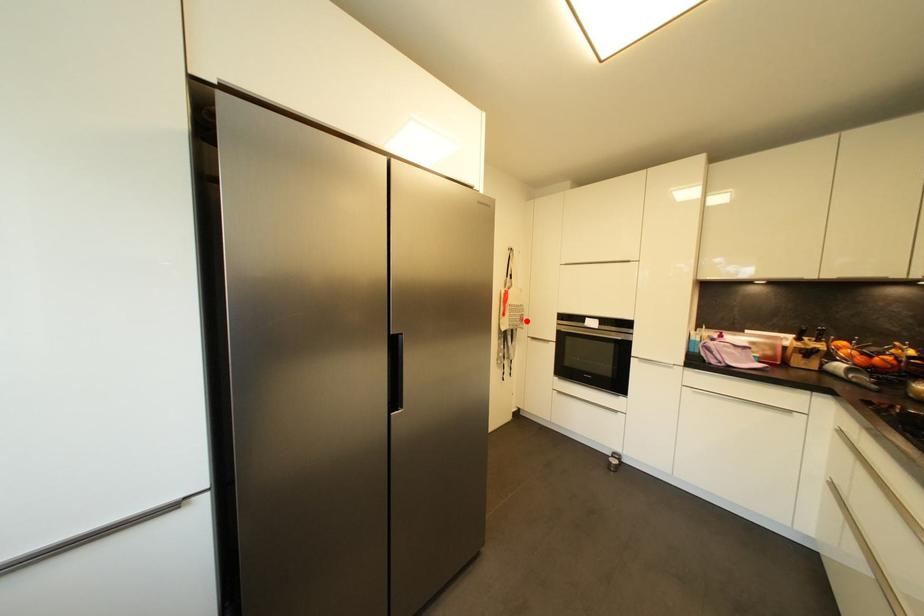
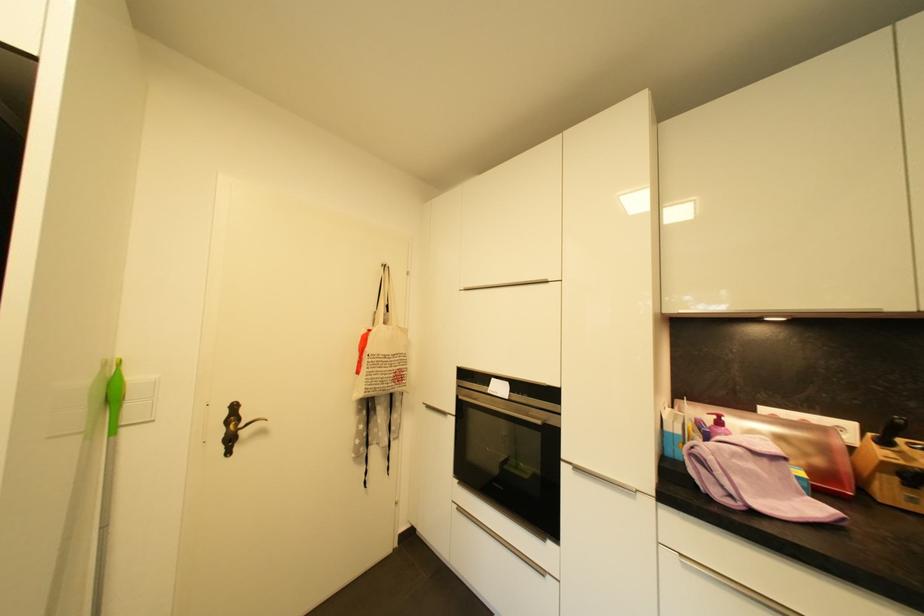
Where in the second image is the point corresponding to the highlighted location from the first image?

(405, 379)